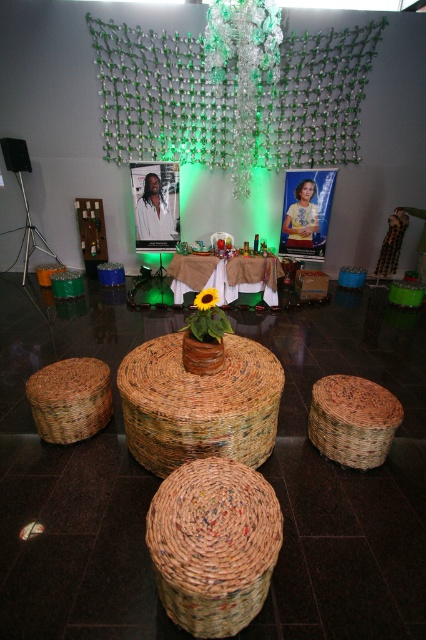
You are at an event and want to place a decorative item between the woven straw basket at center and the yellow matte sunflower at center on the table. Given that the item you have is 10 inches long, will it fit in the space between them?

The woven straw basket at center is 22.64 inches away from the yellow matte sunflower at center. Since the item you have is 10 inches long, it will fit in the space between them as the distance is greater than the item length.

You are arranging flowers for an event and see the woven straw basket at center and the yellow matte sunflower at center. Which object is located to the left of the other?

The woven straw basket at center is positioned on the left side of yellow matte sunflower at center.

You are standing at the entrance of the exhibition hall and see two points marked in the image. The first point is at coordinate point (258, 422) and the second is at point (230, 0). Which point is closer to you?

Point (258, 422) is in front of point (230, 0), so the first point is closer to you.